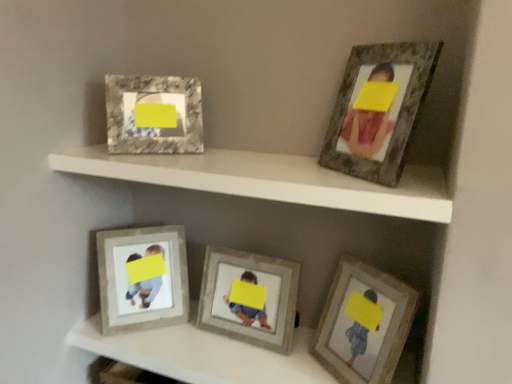
Question: From the image's perspective, does wooden photo frame at lower right, which is the fourth picture frame from left to right, appear lower than matte gray frame at center, arranged as the third picture frame when viewed from the right?

Choices:
 (A) no
 (B) yes

Answer: (B)

Question: Considering the relative positions of wooden photo frame at lower right, which is the fourth picture frame from left to right, and matte gray frame at center, arranged as the third picture frame when viewed from the right, in the image provided, is wooden photo frame at lower right, which is the fourth picture frame from left to right, in front of matte gray frame at center, arranged as the third picture frame when viewed from the right,?

Choices:
 (A) no
 (B) yes

Answer: (B)

Question: Is wooden photo frame at lower right, which is the fourth picture frame from left to right, oriented towards matte gray frame at center, arranged as the third picture frame when viewed from the right?

Choices:
 (A) no
 (B) yes

Answer: (A)

Question: Is wooden photo frame at lower right, which is the fourth picture frame from left to right, to the left of matte gray frame at center, arranged as the third picture frame when viewed from the right, from the viewer's perspective?

Choices:
 (A) yes
 (B) no

Answer: (B)

Question: Is wooden photo frame at lower right, which is the fourth picture frame from left to right, oriented away from matte gray frame at center, arranged as the third picture frame when viewed from the right?

Choices:
 (A) no
 (B) yes

Answer: (A)

Question: Does wooden photo frame at lower right, which is the fourth picture frame from left to right, have a greater height compared to matte gray frame at center, arranged as the third picture frame when viewed from the right?

Choices:
 (A) no
 (B) yes

Answer: (A)

Question: Are wooden textured frame at lower left, arranged as the first picture frame when viewed from the left, and marble-like frame at upper left, arranged as the fourth picture frame when viewed from the right, far apart?

Choices:
 (A) no
 (B) yes

Answer: (A)

Question: Can you confirm if wooden textured frame at lower left, arranged as the first picture frame when viewed from the left, is taller than marble-like frame at upper left, arranged as the fourth picture frame when viewed from the right?

Choices:
 (A) yes
 (B) no

Answer: (A)

Question: Are wooden textured frame at lower left, arranged as the first picture frame when viewed from the left, and marble-like frame at upper left, arranged as the fourth picture frame when viewed from the right, making contact?

Choices:
 (A) yes
 (B) no

Answer: (B)

Question: Is marble-like frame at upper left, arranged as the fourth picture frame when viewed from the right, completely or partially inside wooden textured frame at lower left, arranged as the first picture frame when viewed from the left?

Choices:
 (A) yes
 (B) no

Answer: (B)

Question: Can you confirm if wooden textured frame at lower left, the 5th picture frame in the right-to-left sequence, is thinner than marble-like frame at upper left, arranged as the fourth picture frame when viewed from the right?

Choices:
 (A) no
 (B) yes

Answer: (A)

Question: Can you confirm if wooden textured frame at lower left, the 5th picture frame in the right-to-left sequence, is wider than marble-like frame at upper left, arranged as the fourth picture frame when viewed from the right?

Choices:
 (A) no
 (B) yes

Answer: (B)

Question: Is rustic wood frame at upper right, the 1th picture frame viewed from the right, turned away from marble-like frame at upper left, positioned as the 2th picture frame in left-to-right order?

Choices:
 (A) yes
 (B) no

Answer: (B)